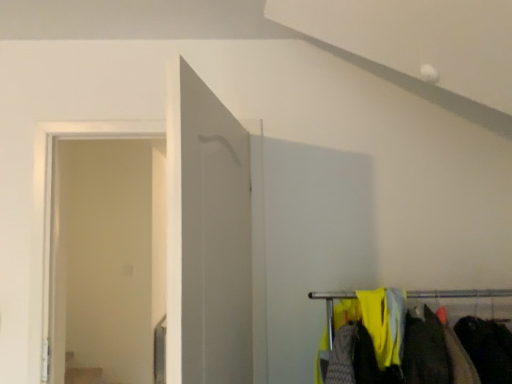
Question: Does white glossy door at center have a lesser width compared to dark gray fabric at lower right?

Choices:
 (A) yes
 (B) no

Answer: (A)

Question: Is white glossy door at center taller than dark gray fabric at lower right?

Choices:
 (A) no
 (B) yes

Answer: (B)

Question: Considering the relative sizes of white glossy door at center and dark gray fabric at lower right in the image provided, is white glossy door at center shorter than dark gray fabric at lower right?

Choices:
 (A) yes
 (B) no

Answer: (B)

Question: Does white glossy door at center turn towards dark gray fabric at lower right?

Choices:
 (A) no
 (B) yes

Answer: (A)

Question: Considering the relative sizes of white glossy door at center and dark gray fabric at lower right in the image provided, is white glossy door at center wider than dark gray fabric at lower right?

Choices:
 (A) yes
 (B) no

Answer: (B)

Question: Is white glossy door at center beside dark gray fabric at lower right?

Choices:
 (A) yes
 (B) no

Answer: (B)

Question: Does dark gray fabric at lower right turn towards transparent glass door at left?

Choices:
 (A) no
 (B) yes

Answer: (A)

Question: Does dark gray fabric at lower right have a greater height compared to transparent glass door at left?

Choices:
 (A) no
 (B) yes

Answer: (A)

Question: Is dark gray fabric at lower right directly adjacent to transparent glass door at left?

Choices:
 (A) yes
 (B) no

Answer: (B)

Question: Does dark gray fabric at lower right have a smaller size compared to transparent glass door at left?

Choices:
 (A) no
 (B) yes

Answer: (B)

Question: From the image's perspective, would you say dark gray fabric at lower right is positioned over transparent glass door at left?

Choices:
 (A) no
 (B) yes

Answer: (A)

Question: Is dark gray fabric at lower right positioned before transparent glass door at left?

Choices:
 (A) yes
 (B) no

Answer: (A)

Question: Does transparent glass door at left have a greater width compared to dark gray fabric at lower right?

Choices:
 (A) no
 (B) yes

Answer: (A)